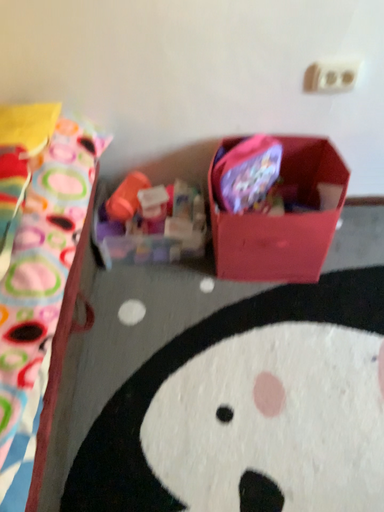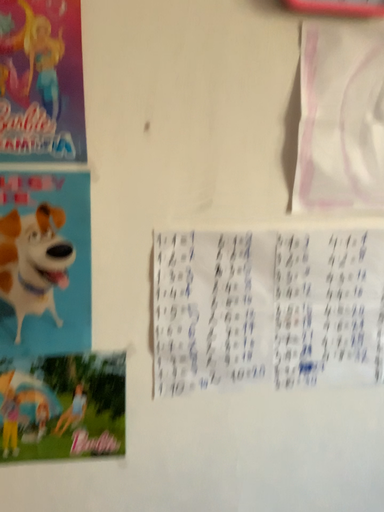
Question: Which way did the camera rotate in the video?

Choices:
 (A) rotated upward
 (B) rotated downward

Answer: (A)